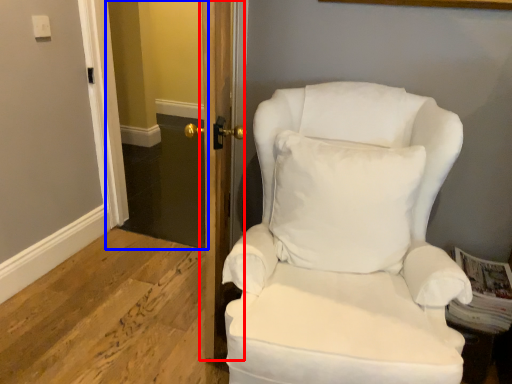
Question: Which object appears closest to the camera in this image, door (highlighted by a red box) or glass door (highlighted by a blue box)?

Choices:
 (A) door
 (B) glass door

Answer: (A)